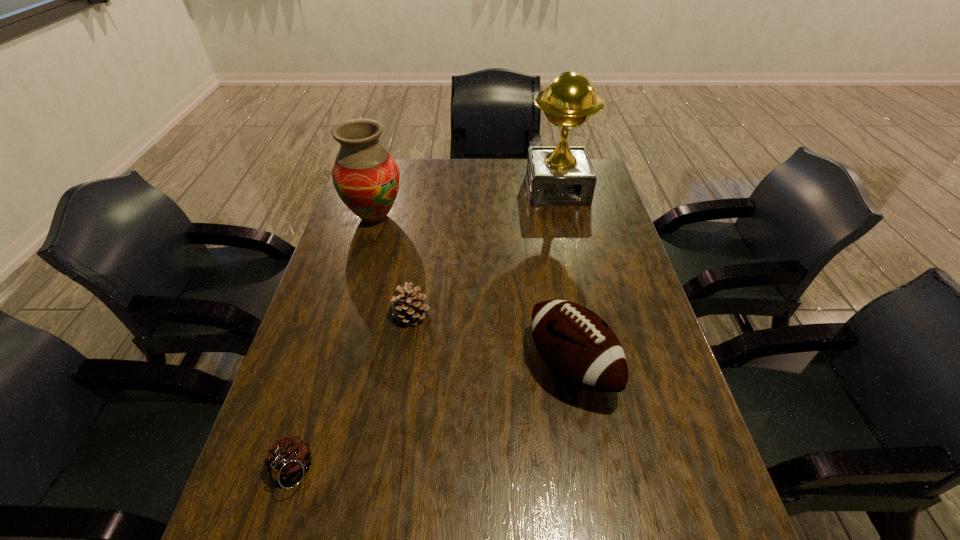
The height and width of the screenshot is (540, 960). I want to click on vacant space located on the right of the right pinecone, so click(568, 315).

In order to click on vacant space situated 0.050m with a leaf charm attached to the nearer pinecone in this screenshot , I will do `click(275, 526)`.

Locate an element on the screen. The width and height of the screenshot is (960, 540). object that is at the far edge is located at coordinates (562, 175).

Where is `vase that is at the left edge`? vase that is at the left edge is located at coordinates (366, 178).

The width and height of the screenshot is (960, 540). In order to click on pinecone present at the left edge in this screenshot , I will do `click(288, 458)`.

Where is `award that is positioned at the right edge`? The image size is (960, 540). award that is positioned at the right edge is located at coordinates (562, 175).

Where is `football (American) positioned at the right edge`? The width and height of the screenshot is (960, 540). football (American) positioned at the right edge is located at coordinates (580, 347).

Find the location of a particular element. The image size is (960, 540). object located in the far right corner section of the desktop is located at coordinates (562, 175).

Identify the location of vacant space at the far edge. (523, 159).

In the image, there is a desktop. Identify the location of vacant space at the left edge. (346, 354).